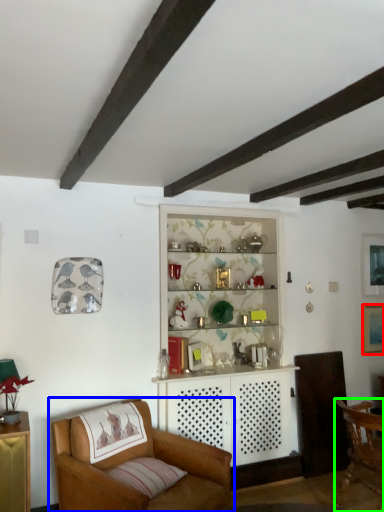
Question: Considering the real-world distances, which object is closest to picture frame (highlighted by a red box)? chair (highlighted by a blue box) or chair (highlighted by a green box).

Choices:
 (A) chair
 (B) chair

Answer: (B)